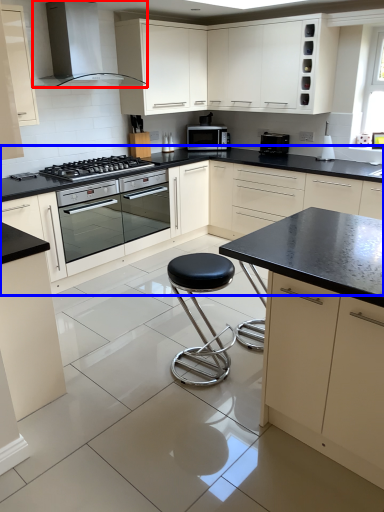
Question: Among these objects, which one is farthest to the camera, home appliance (highlighted by a red box) or cabinetry (highlighted by a blue box)?

Choices:
 (A) home appliance
 (B) cabinetry

Answer: (B)